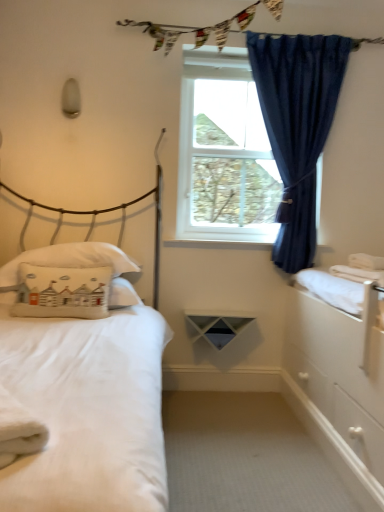
You are a GUI agent. You are given a task and a screenshot of the screen. Output one action in this format:
    pyautogui.click(x=<x>, y=<y>)
    Task: Click on the empty space that is ontop of textured fabric clothesline at upper center
    
    Given the screenshot: What is the action you would take?
    pyautogui.click(x=246, y=20)